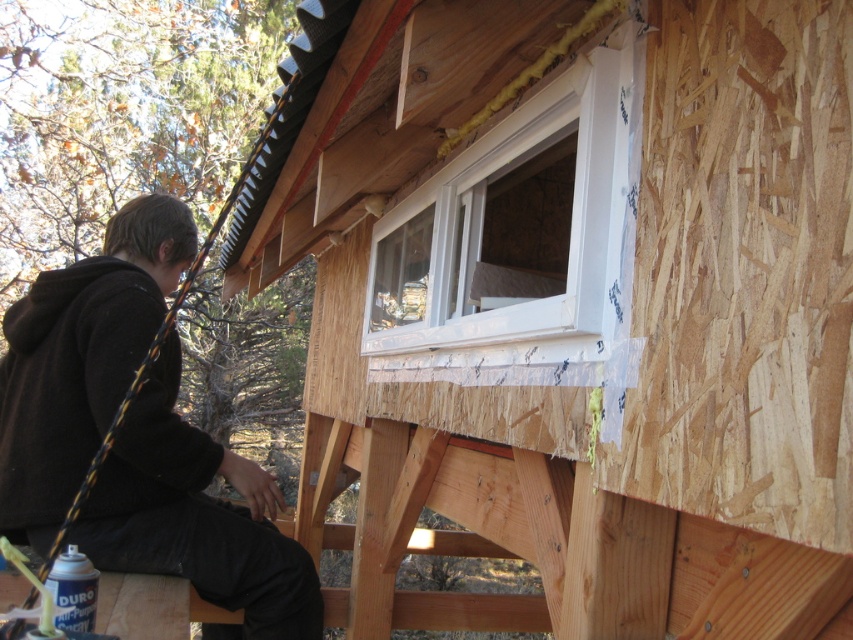
Question: Can you confirm if black hoodie at left is positioned below white plastic window at upper center?

Choices:
 (A) yes
 (B) no

Answer: (A)

Question: Is black hoodie at left further to the viewer compared to white plastic window at upper center?

Choices:
 (A) yes
 (B) no

Answer: (A)

Question: Which point is farther from the camera taking this photo?

Choices:
 (A) (202, 588)
 (B) (488, 237)

Answer: (B)

Question: Among these points, which one is farthest from the camera?

Choices:
 (A) (154, 557)
 (B) (590, 122)

Answer: (A)

Question: Where is black hoodie at left located in relation to white plastic window at upper center in the image?

Choices:
 (A) above
 (B) below

Answer: (B)